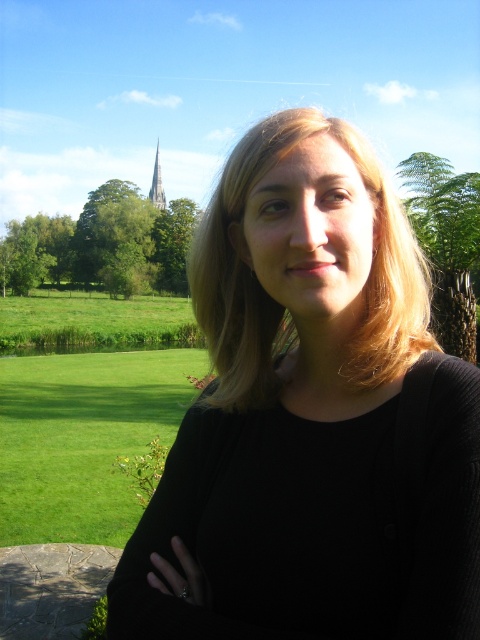
You are a photographer trying to capture the scene with a wide angle lens. You notice two points in the image labeled as point (362, 332) and point (445, 253). Which point is positioned closer to the camera?

Point (362, 332) is closer to the camera than point (445, 253).

You are a photographer trying to capture the entire scene in one shot. You notice the black fabric arm at center and the green leafy tree at upper center. Which object is shorter and needs to be framed carefully to ensure it doesn not get cut off?

The black fabric arm at center is shorter than the green leafy tree at upper center, so it needs to be framed carefully to ensure it doesn not get cut off.

You are a photographer trying to capture a portrait of the person with blonde smooth hair at center. You want to ensure the church spire in the background is still in focus. Given that your camera has a depth of field range of 10 meters, will you be able to achieve this?

The blonde smooth hair at center and camera are 11.71 meters apart, which exceeds the camera depth of field range of 10 meters. Therefore, the church spire in the background will not be in focus.